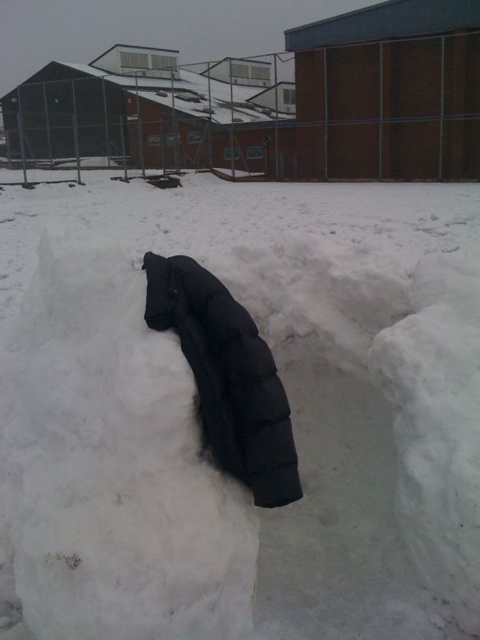
Question: Is white fluffy snow at center wider than black down jacket at center?

Choices:
 (A) yes
 (B) no

Answer: (A)

Question: Observing the image, what is the correct spatial positioning of white fluffy snow at center in reference to black down jacket at center?

Choices:
 (A) below
 (B) above

Answer: (B)

Question: Does white fluffy snow at center have a lesser width compared to black down jacket at center?

Choices:
 (A) no
 (B) yes

Answer: (A)

Question: Which of the following is the closest to the observer?

Choices:
 (A) white fluffy snow at center
 (B) black down jacket at center

Answer: (A)